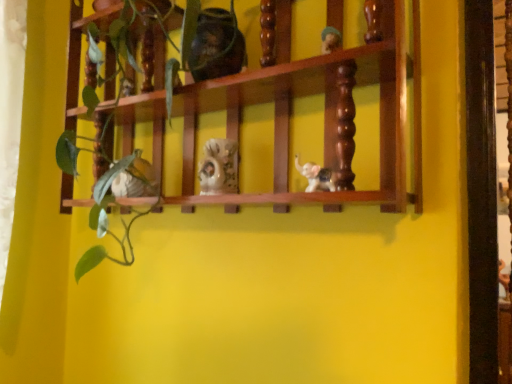
Question: Can we say matte ceramic elephant at center, the 1th toy in the right-to-left sequence, lies outside porcelain figurine at center, which is the third toy in left-to-right order?

Choices:
 (A) yes
 (B) no

Answer: (A)

Question: Can you confirm if matte ceramic elephant at center, which ranks as the fourth toy in left-to-right order, is thinner than porcelain figurine at center, which is the third toy in bottom-to-top order?

Choices:
 (A) yes
 (B) no

Answer: (A)

Question: Could you tell me if matte ceramic elephant at center, the 1th toy in the right-to-left sequence, is facing porcelain figurine at center, which is the 2th toy from top to bottom?

Choices:
 (A) no
 (B) yes

Answer: (A)

Question: From the image's perspective, is matte ceramic elephant at center, which ranks as the fourth toy in left-to-right order, under porcelain figurine at center, which is the third toy in left-to-right order?

Choices:
 (A) yes
 (B) no

Answer: (A)

Question: Is the position of matte ceramic elephant at center, the 1th toy in the right-to-left sequence, more distant than that of porcelain figurine at center, which is the 2th toy from top to bottom?

Choices:
 (A) yes
 (B) no

Answer: (B)

Question: From the image's perspective, is matte brown vase at upper center, which ranks as the second toy in left-to-right order, located above or below porcelain figurine at center, which is the third toy in bottom-to-top order?

Choices:
 (A) above
 (B) below

Answer: (A)

Question: In terms of width, does matte brown vase at upper center, the third toy in the right-to-left sequence, look wider or thinner when compared to porcelain figurine at center, which is the third toy in left-to-right order?

Choices:
 (A) thin
 (B) wide

Answer: (B)

Question: Visually, is matte brown vase at upper center, the third toy in the right-to-left sequence, positioned to the left or to the right of porcelain figurine at center, which is the third toy in bottom-to-top order?

Choices:
 (A) left
 (B) right

Answer: (A)

Question: From their relative heights in the image, would you say matte brown vase at upper center, which ranks as the second toy in left-to-right order, is taller or shorter than porcelain figurine at center, which ranks as the second toy in right-to-left order?

Choices:
 (A) short
 (B) tall

Answer: (B)

Question: Looking at their shapes, would you say matte ceramic elephant at center, which appears as the 1th toy when viewed from the left, is wider or thinner than green matte plant at center?

Choices:
 (A) wide
 (B) thin

Answer: (B)

Question: Does point (128, 180) appear closer or farther from the camera than point (135, 1)?

Choices:
 (A) farther
 (B) closer

Answer: (A)

Question: In the image, is matte ceramic elephant at center, which appears as the 1th toy when viewed from the left, positioned in front of or behind green matte plant at center?

Choices:
 (A) behind
 (B) front

Answer: (A)

Question: From a real-world perspective, is matte ceramic elephant at center, which ranks as the 3th toy in top-to-bottom order, physically located above or below green matte plant at center?

Choices:
 (A) above
 (B) below

Answer: (B)

Question: In terms of width, does matte ceramic elephant at center, which ranks as the fourth toy in left-to-right order, look wider or thinner when compared to wooden shelf at center?

Choices:
 (A) wide
 (B) thin

Answer: (B)

Question: Is matte ceramic elephant at center, the fourth toy from the top, bigger or smaller than wooden shelf at center?

Choices:
 (A) small
 (B) big

Answer: (A)